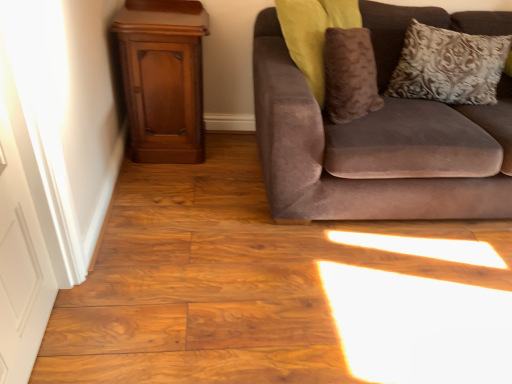
Identify the location of vacant region in front of mahogany wood dresser at left. [167, 189].